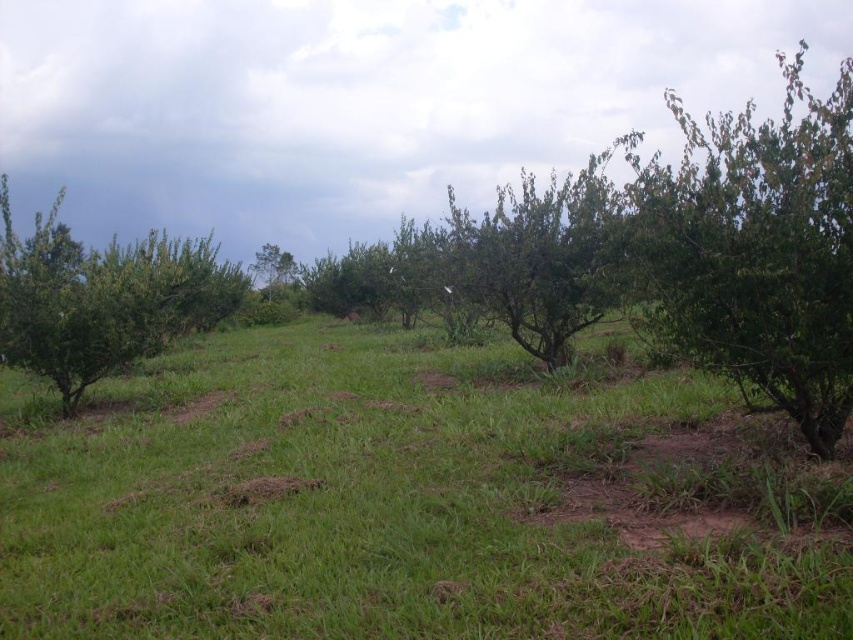
Question: Which point is farther from the camera taking this photo?

Choices:
 (A) (213, 305)
 (B) (761, 224)

Answer: (A)

Question: Can you confirm if green leafy tree at right is wider than green leafy tree at left?

Choices:
 (A) no
 (B) yes

Answer: (B)

Question: Considering the relative positions of green grassy at center and green leafy tree at right in the image provided, where is green grassy at center located with respect to green leafy tree at right?

Choices:
 (A) below
 (B) above

Answer: (A)

Question: Which point is closer to the camera?

Choices:
 (A) green leafy tree at right
 (B) green grassy at center

Answer: (B)

Question: Which of the following is the farthest from the observer?

Choices:
 (A) pyautogui.click(x=202, y=304)
 (B) pyautogui.click(x=4, y=534)
 (C) pyautogui.click(x=645, y=252)

Answer: (A)

Question: Where is green leafy tree at right located in relation to green leafy tree at left in the image?

Choices:
 (A) above
 (B) below

Answer: (A)